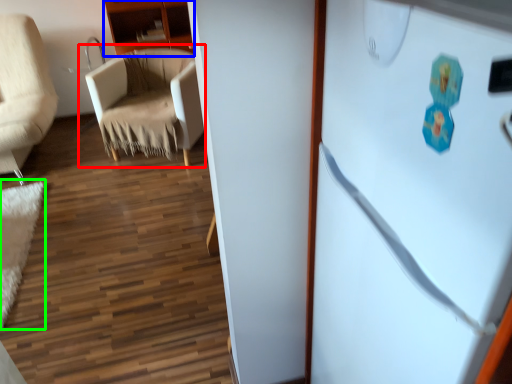
Question: Which object is positioned closest to chair (highlighted by a red box)? Select from cabinetry (highlighted by a blue box) and mat (highlighted by a green box).

Choices:
 (A) cabinetry
 (B) mat

Answer: (A)